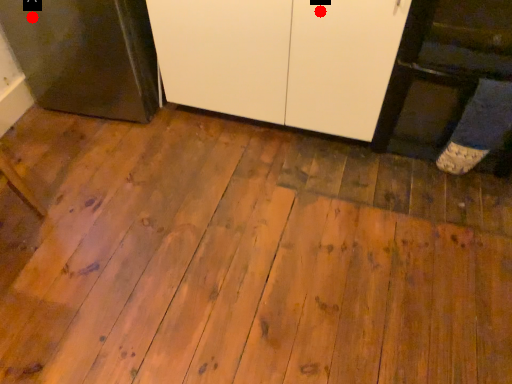
Question: Two points are circled on the image, labeled by A and B beside each circle. Which point is farther to the camera?

Choices:
 (A) A is further
 (B) B is further

Answer: (A)